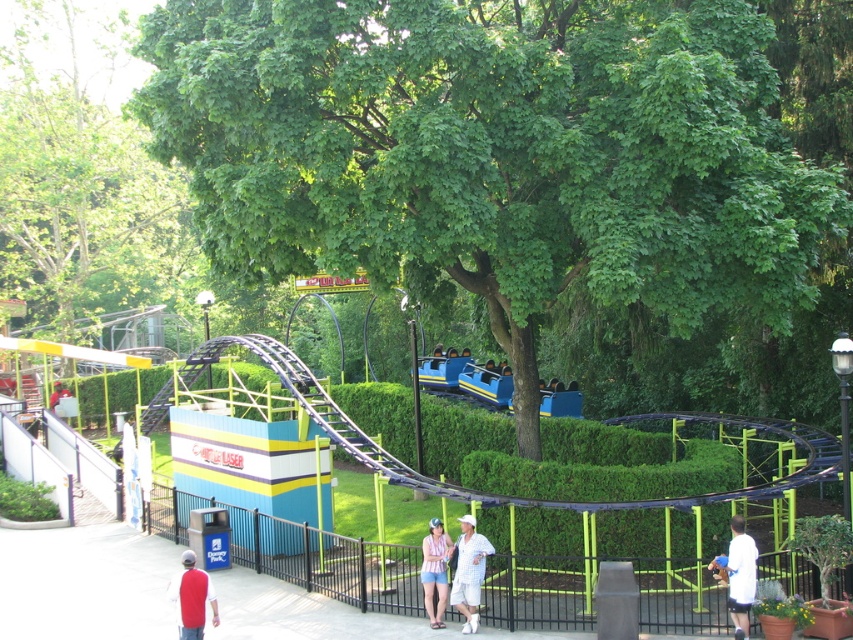
Question: Does green leafy tree at upper center appear over striped cotton shirt at center?

Choices:
 (A) no
 (B) yes

Answer: (B)

Question: Does striped cotton shirt at center lie behind matte white shirt at lower left?

Choices:
 (A) no
 (B) yes

Answer: (A)

Question: Which point is farther from the camera taking this photo?

Choices:
 (A) (741, 637)
 (B) (9, 104)
 (C) (440, 532)

Answer: (B)

Question: Which point is farther to the camera?

Choices:
 (A) (439, 627)
 (B) (175, 170)
 (C) (474, 564)

Answer: (B)

Question: Where is white cotton shirt at lower right located in relation to matte white shirt at lower left in the image?

Choices:
 (A) right
 (B) left

Answer: (A)

Question: Which object is the farthest from the green leafy tree at upper center?

Choices:
 (A) red cotton shirt at lower left
 (B) white cotton shirt at lower right

Answer: (A)